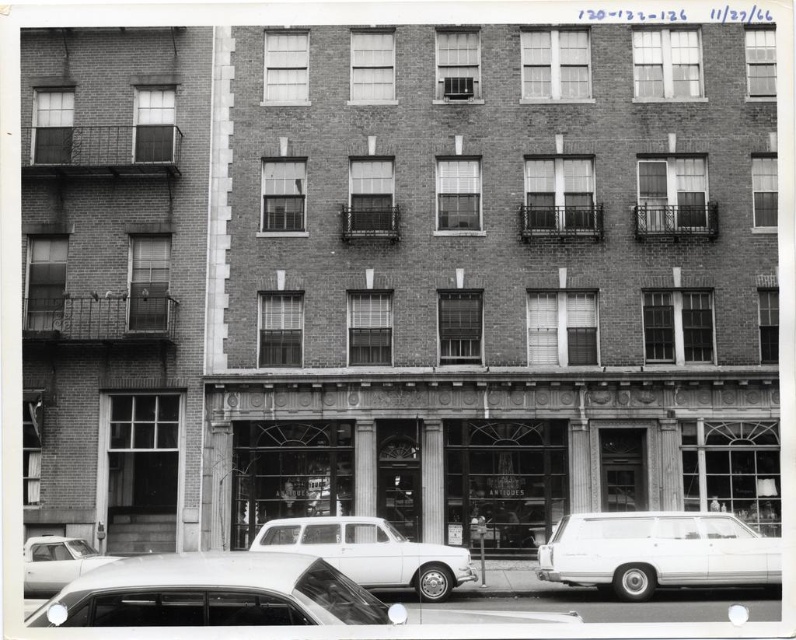
Based on the photo, you are a pedestrian standing in front of the building and want to cross the street. There are two cars in the scene, a shiny silver sedan at lower left and a white matte station wagon at center. Which car is closer to you?

The shiny silver sedan at lower left is closer to the viewer than the white matte station wagon at center.

You are a pedestrian standing in front of the building and want to cross the street. There are two cars parked nearby, a white matte station wagon at center and a white matte sedan at lower left. Which car is closer to you?

The white matte station wagon at center is closer to the viewer than the white matte sedan at lower left.

You are a delivery person trying to park a 1.8 meters tall package in the parking lot. The parking lot has two vehicles, a shiny silver sedan at lower left and a white matte station wagon at center. Which vehicle should you park the package next to so it doesn t hit the package when opening doors?

The shiny silver sedan at lower left has a greater height compared to the white matte station wagon at center. Since the package is 1.8 meters tall, parking it next to the taller vehicle, the shiny silver sedan at lower left, would provide more clearance to avoid hitting the package when opening doors.